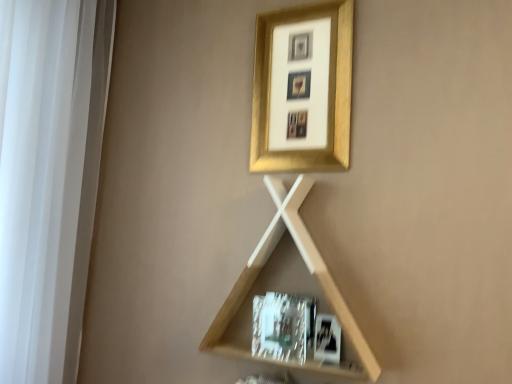
Question: Would you consider metallic silver picture frame at lower right, the 1th picture frame when ordered from front to back, to be distant from light wood/texture shelf at center?

Choices:
 (A) no
 (B) yes

Answer: (A)

Question: Is metallic silver picture frame at lower right, the second picture frame in the back-to-front sequence, shorter than light wood/texture shelf at center?

Choices:
 (A) no
 (B) yes

Answer: (B)

Question: Can you confirm if metallic silver picture frame at lower right, the second picture frame in the back-to-front sequence, is taller than light wood/texture shelf at center?

Choices:
 (A) no
 (B) yes

Answer: (A)

Question: Considering the relative sizes of metallic silver picture frame at lower right, positioned as the 2th picture frame in top-to-bottom order, and light wood/texture shelf at center in the image provided, is metallic silver picture frame at lower right, positioned as the 2th picture frame in top-to-bottom order, bigger than light wood/texture shelf at center?

Choices:
 (A) no
 (B) yes

Answer: (A)

Question: Can you confirm if metallic silver picture frame at lower right, the second picture frame in the back-to-front sequence, is smaller than light wood/texture shelf at center?

Choices:
 (A) no
 (B) yes

Answer: (B)

Question: Considering the relative positions of metallic silver picture frame at lower right, the 1th picture frame when ordered from front to back, and light wood/texture shelf at center in the image provided, is metallic silver picture frame at lower right, the 1th picture frame when ordered from front to back, to the right of light wood/texture shelf at center from the viewer's perspective?

Choices:
 (A) yes
 (B) no

Answer: (A)

Question: Would you say white fabric at left is part of metallic silver picture frame at lower right, the 1th picture frame when ordered from front to back,'s contents?

Choices:
 (A) no
 (B) yes

Answer: (A)

Question: From a real-world perspective, is metallic silver picture frame at lower right, positioned as the 2th picture frame in top-to-bottom order, on white fabric at left?

Choices:
 (A) yes
 (B) no

Answer: (B)

Question: Is metallic silver picture frame at lower right, the 1th picture frame when ordered from front to back, to the right of white fabric at left from the viewer's perspective?

Choices:
 (A) no
 (B) yes

Answer: (B)

Question: Are metallic silver picture frame at lower right, positioned as the 2th picture frame in top-to-bottom order, and white fabric at left far apart?

Choices:
 (A) no
 (B) yes

Answer: (A)

Question: From a real-world perspective, is metallic silver picture frame at lower right, which is the first picture frame from bottom to top, beneath white fabric at left?

Choices:
 (A) no
 (B) yes

Answer: (B)

Question: Is metallic silver picture frame at lower right, the 1th picture frame when ordered from front to back, oriented away from white fabric at left?

Choices:
 (A) yes
 (B) no

Answer: (B)

Question: Can you confirm if gold metallic picture frame at upper center, the 2th picture frame in the bottom-to-top sequence, is wider than metallic silver picture frame at lower right, which is the first picture frame from bottom to top?

Choices:
 (A) yes
 (B) no

Answer: (A)